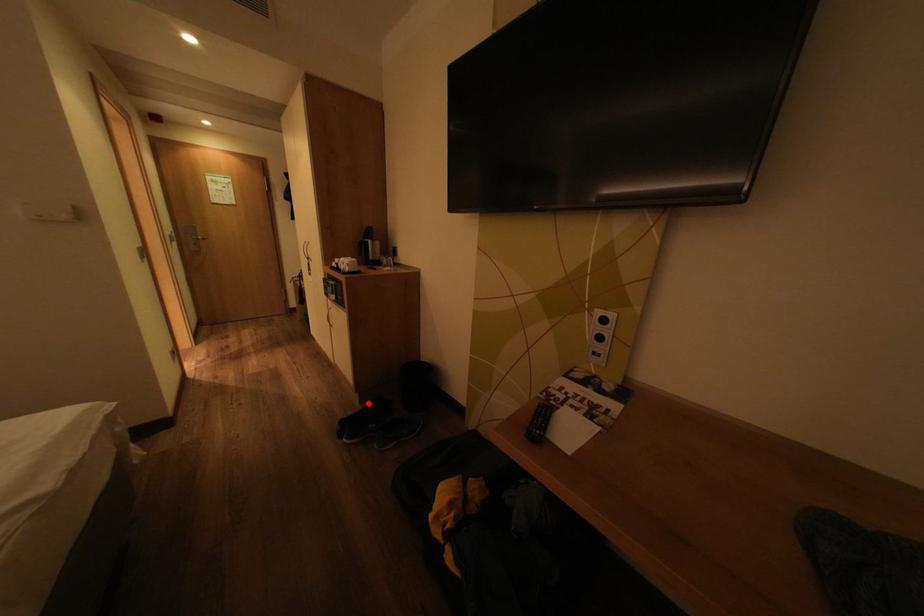
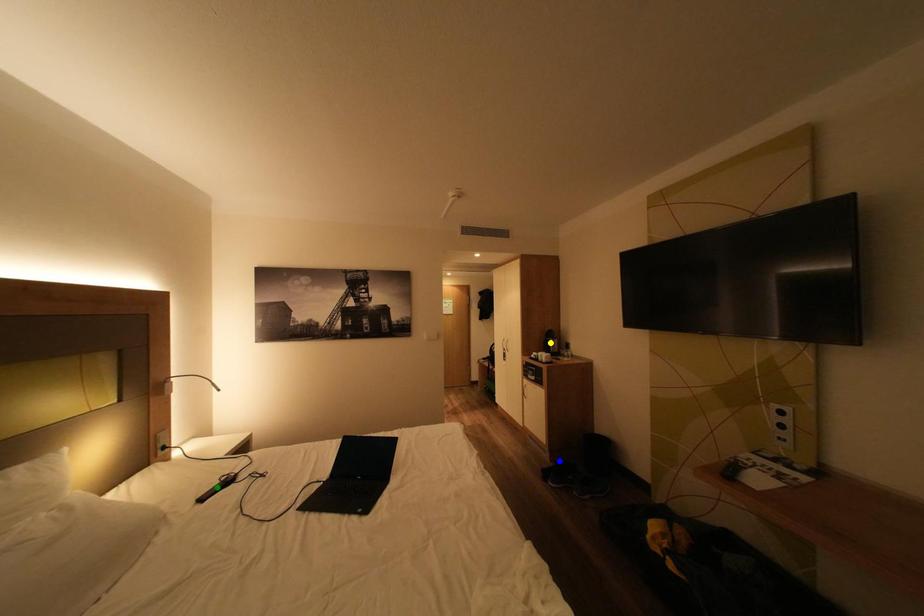
Question: I am providing you with two images of the same scene from different viewpoints. A red point is marked on the first image. You are given multiple points on the second image. Which point in image 2 is actually the same real-world point as the red point in image 1?

Choices:
 (A) blue point
 (B) green point
 (C) yellow point

Answer: (A)